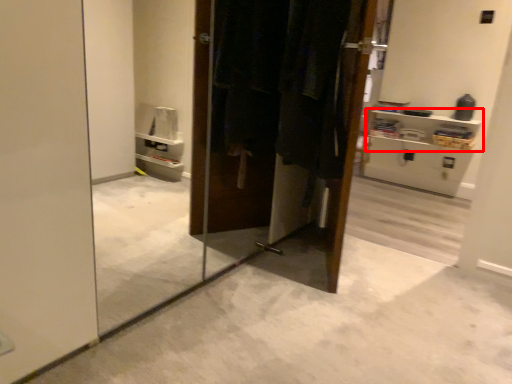
Question: From the image's perspective, considering the relative positions of shelf (annotated by the red box) and laundry in the image provided, where is shelf (annotated by the red box) located with respect to the staircase?

Choices:
 (A) above
 (B) below

Answer: (A)